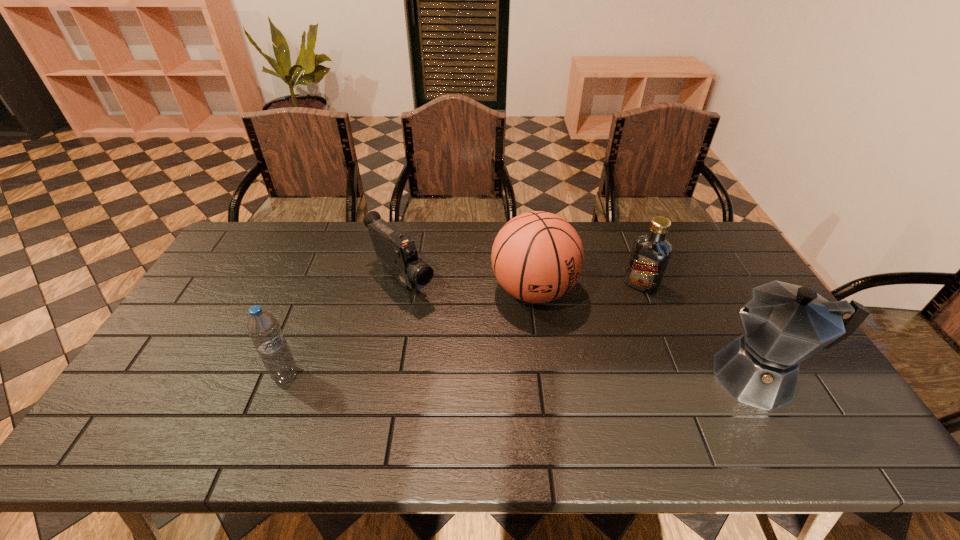
Where is `water bottle`? This screenshot has height=540, width=960. water bottle is located at coordinates (263, 328).

You are a GUI agent. You are given a task and a screenshot of the screen. Output one action in this format:
    pyautogui.click(x=<x>, y=<y>)
    Task: Click on the coffeepot
    The width and height of the screenshot is (960, 540).
    Given the screenshot: What is the action you would take?
    pyautogui.click(x=784, y=324)

Locate an element on the screen. This screenshot has width=960, height=540. camcorder is located at coordinates point(397,253).

The height and width of the screenshot is (540, 960). I want to click on the fourth object from right to left, so click(x=397, y=253).

Locate an element on the screen. This screenshot has height=540, width=960. vodka is located at coordinates (651, 252).

This screenshot has height=540, width=960. Identify the location of the third object from left to right. (537, 257).

This screenshot has width=960, height=540. Identify the location of vacant area located on the left of the water bottle. (207, 375).

This screenshot has width=960, height=540. Find the location of `free space located 0.180m at the spout of the coffeepot`. free space located 0.180m at the spout of the coffeepot is located at coordinates (635, 377).

This screenshot has width=960, height=540. I want to click on free location located 0.160m at the spout of the coffeepot, so click(642, 377).

I want to click on vacant space located at the spout of the coffeepot, so click(646, 377).